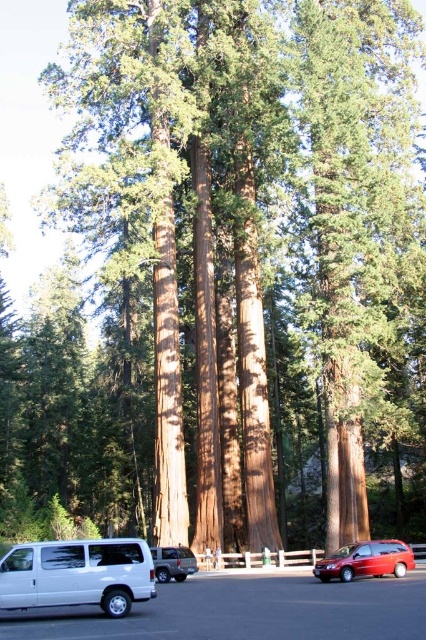
Is white van at center thinner than shiny red car at lower right?

In fact, white van at center might be wider than shiny red car at lower right.

In the scene shown: Does white van at center have a greater height compared to shiny red car at lower right?

Correct, white van at center is much taller as shiny red car at lower right.

Locate an element on the screen. white van at center is located at coordinates (245, 611).

Where is `white van at center`? The image size is (426, 640). white van at center is located at coordinates (245, 611).

How much distance is there between white matte van at lower left and metallic silver suv at center?

white matte van at lower left is 9.93 meters away from metallic silver suv at center.

Between white matte van at lower left and metallic silver suv at center, which one appears on the left side from the viewer's perspective?

From the viewer's perspective, metallic silver suv at center appears more on the left side.

Does point (124, 561) come farther from viewer compared to point (181, 579)?

That is False.

Image resolution: width=426 pixels, height=640 pixels. In order to click on white matte van at lower left in this screenshot , I will do `click(77, 573)`.

Can you confirm if white van at center is positioned to the right of metallic silver suv at center?

Yes, white van at center is to the right of metallic silver suv at center.

Is white van at center smaller than metallic silver suv at center?

Incorrect, white van at center is not smaller in size than metallic silver suv at center.

The height and width of the screenshot is (640, 426). In order to click on white van at center in this screenshot , I will do `click(245, 611)`.